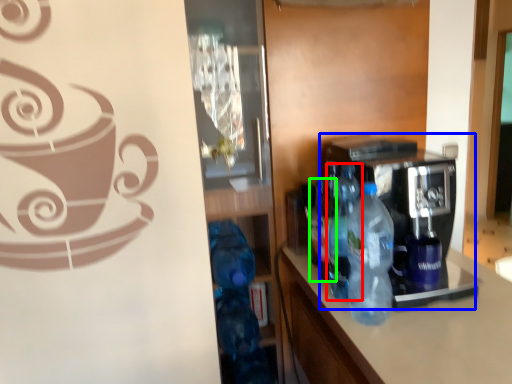
Question: Based on their relative distances, which object is nearer to bottle (highlighted by a red box)? Choose from coffee machine (highlighted by a blue box) and bottle (highlighted by a green box).

Choices:
 (A) coffee machine
 (B) bottle

Answer: (B)